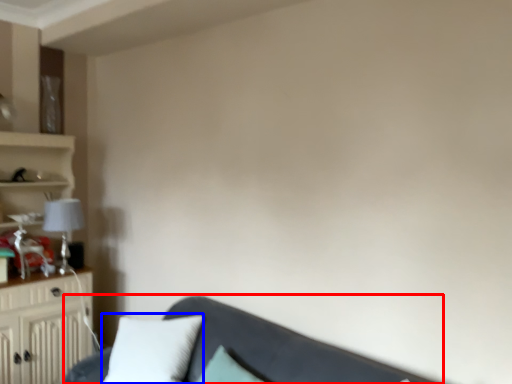
Question: Which object appears closest to the camera in this image, studio couch (highlighted by a red box) or pillow (highlighted by a blue box)?

Choices:
 (A) studio couch
 (B) pillow

Answer: (A)